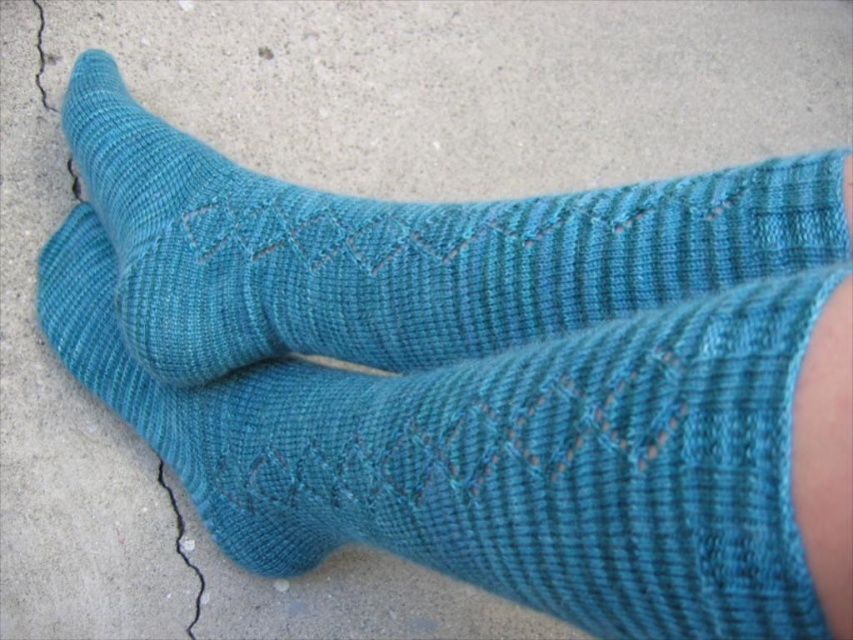
You are standing on a concrete path and see the point marked at coordinates (489, 410). What object is located at that point?

The point at coordinates (489, 410) indicates the teal knitted socks at center.

You are trying to place both the teal knitted socks at center and the teal knitted sock at center into a drawer that can only fit items up to 10 inches in width. Based on the image, can you determine if both items will fit together?

The teal knitted socks at center might be wider than the teal knitted sock at center, but without specific width measurements, it is uncertain if they will fit together in the drawer.